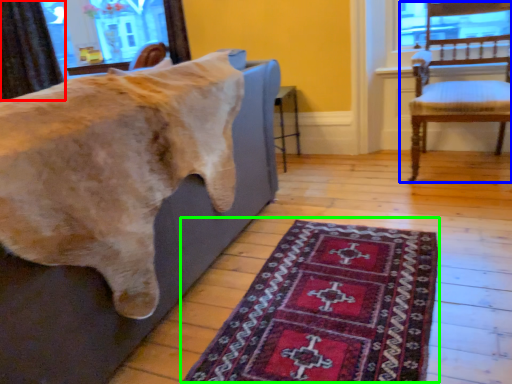
Question: Which is nearer to the curtain (highlighted by a red box)? chair (highlighted by a blue box) or mat (highlighted by a green box).

Choices:
 (A) chair
 (B) mat

Answer: (A)